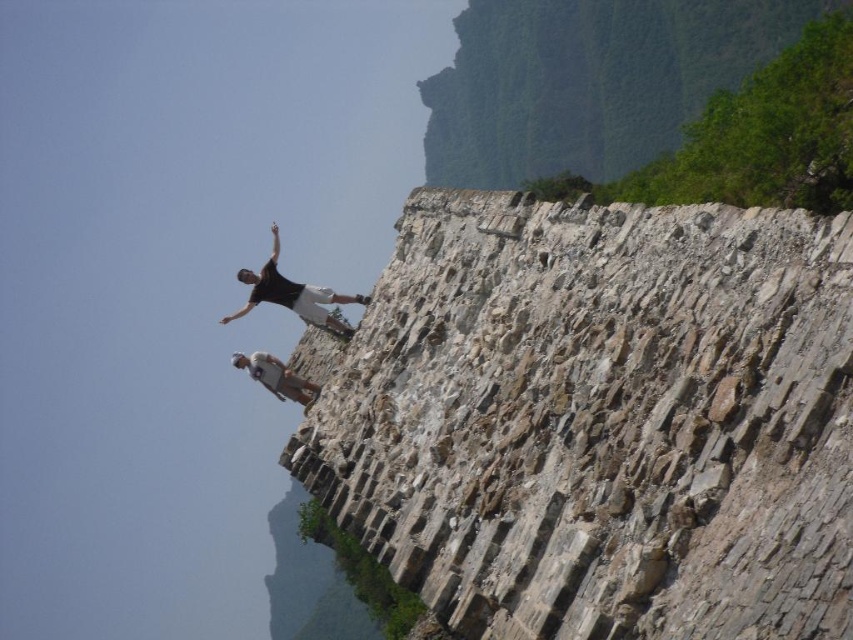
You are a photographer trying to capture a photo of the gray stone wall at upper center and the white fabric shirt at upper center. Since you want both subjects to be clearly visible in the frame, which one should you focus on first to ensure proper focus?

The gray stone wall at upper center is much taller than the white fabric shirt at upper center. To ensure both are in focus, you should focus on the gray stone wall at upper center first, as it is larger and requires more attention to detail.